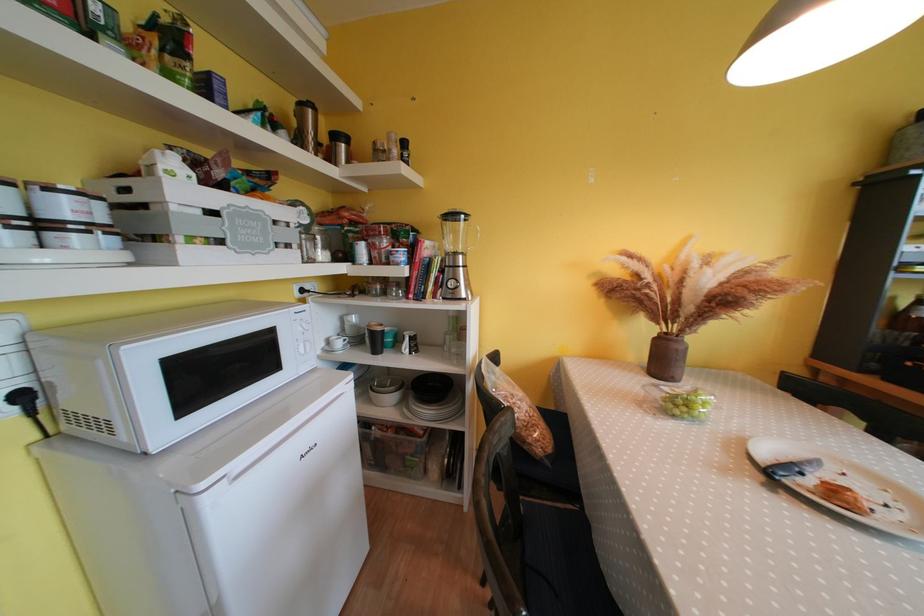
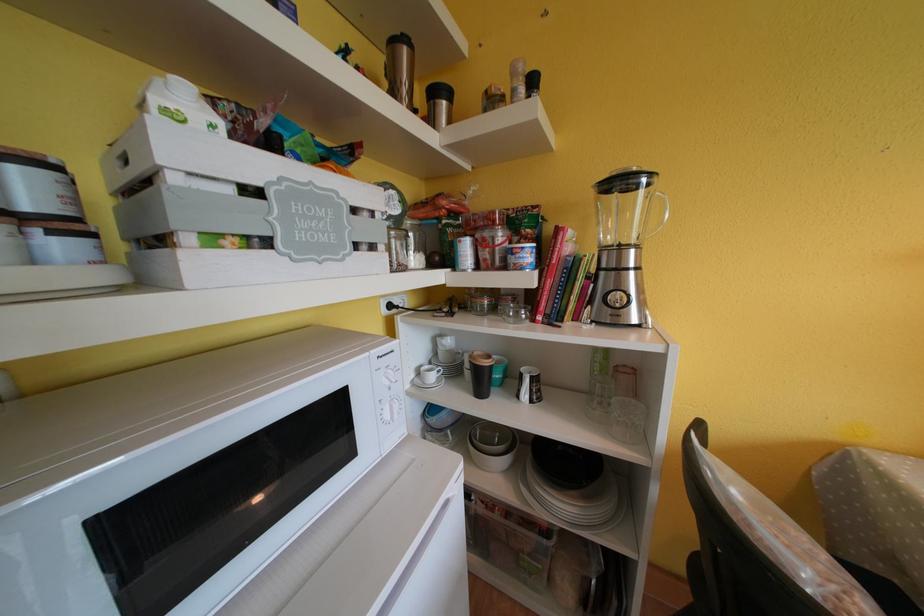
Locate, in the second image, the point that corresponds to [309,294] in the first image.

(396, 310)